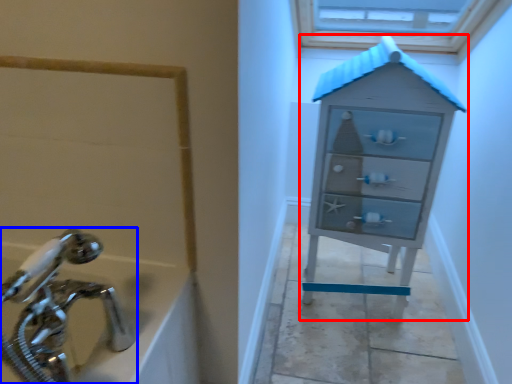
Question: Among these objects, which one is nearest to the camera, chest of drawers (highlighted by a red box) or tap (highlighted by a blue box)?

Choices:
 (A) chest of drawers
 (B) tap

Answer: (B)